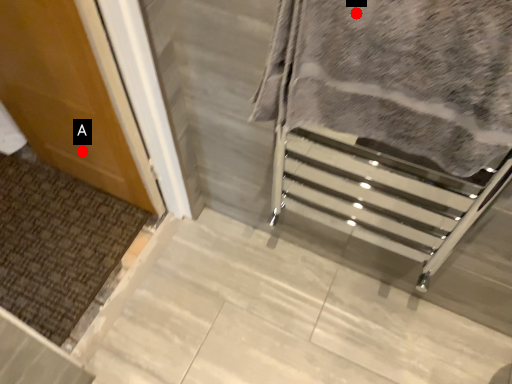
Question: Two points are circled on the image, labeled by A and B beside each circle. Which of the following is the closest to the observer?

Choices:
 (A) A is closer
 (B) B is closer

Answer: (B)